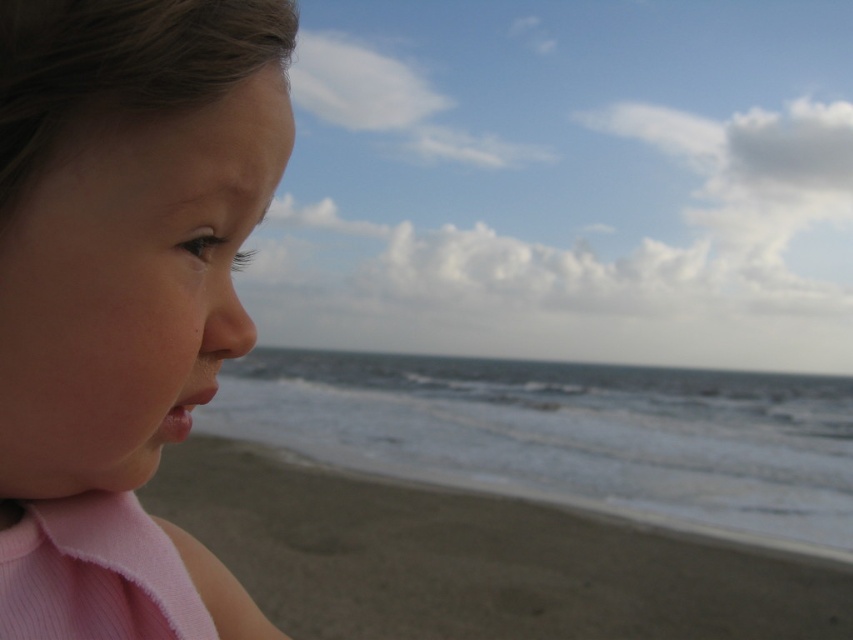
You are a photographer trying to capture the pink fabric at left and the smooth sand at lower left in the same frame. Based on their widths, which object should you focus on first to ensure both fit in the shot?

The pink fabric at left has a lesser width compared to the smooth sand at lower left, so you should focus on the pink fabric at left first to ensure both fit in the shot.